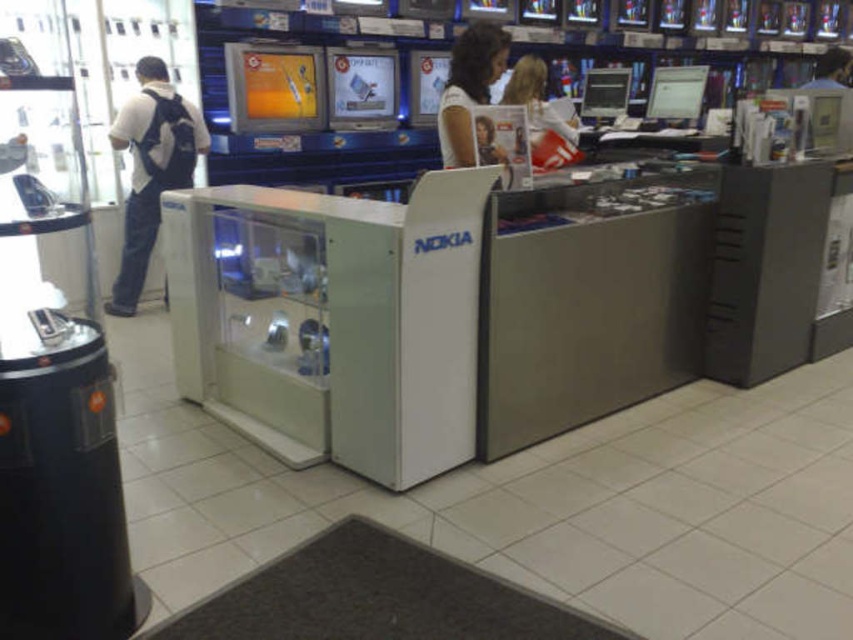
You are a customer in the electronics store looking for a backpack to carry your new phone. You see the white fabric backpack at left and the blonde hair at center. Which item is taller?

The white fabric backpack at left is taller than the blonde hair at center.